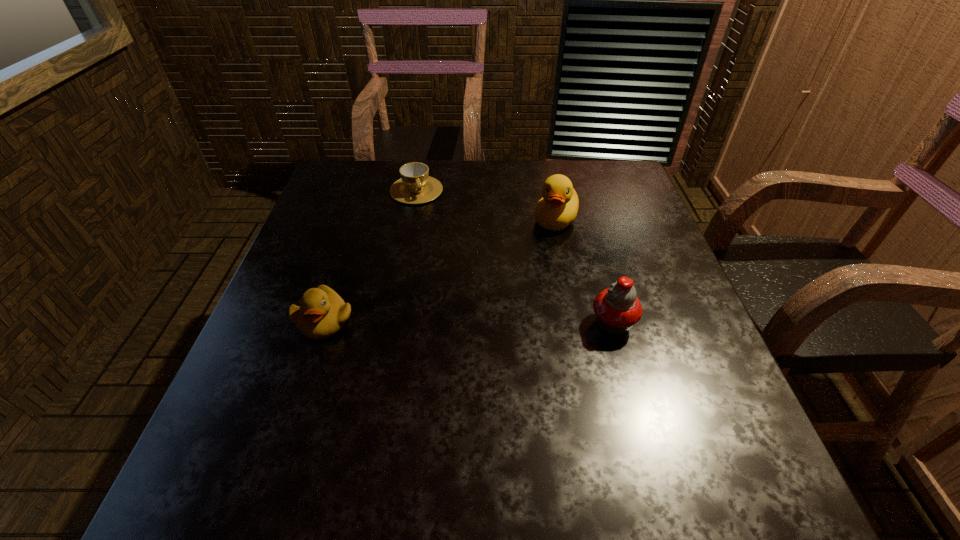
Where is `vacant space at the left edge of the desktop`? vacant space at the left edge of the desktop is located at coordinates (318, 360).

Image resolution: width=960 pixels, height=540 pixels. I want to click on blank space at the right edge, so click(648, 237).

Identify the location of vacant region at the far left corner of the desktop. (367, 194).

I want to click on blank space at the near left corner of the desktop, so click(x=304, y=420).

Find the location of a particular element. vacant space at the far right corner of the desktop is located at coordinates (608, 178).

Image resolution: width=960 pixels, height=540 pixels. I want to click on vacant point located between the cupcake and the duckling, so click(x=468, y=322).

Image resolution: width=960 pixels, height=540 pixels. In order to click on vacant area between the second shortest object and the duck in this screenshot , I will do `click(440, 271)`.

Locate an element on the screen. This screenshot has height=540, width=960. free space that is in between the duckling and the duck is located at coordinates (440, 271).

Locate an element on the screen. This screenshot has height=540, width=960. free space between the duck and the duckling is located at coordinates (440, 271).

The width and height of the screenshot is (960, 540). Identify the location of empty space that is in between the cup and the duckling. (371, 255).